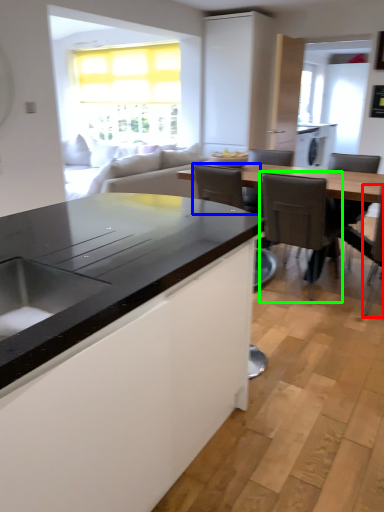
Question: Which object is the closest to the chair (highlighted by a red box)? Choose among these: armchair (highlighted by a blue box) or chair (highlighted by a green box).

Choices:
 (A) armchair
 (B) chair

Answer: (B)